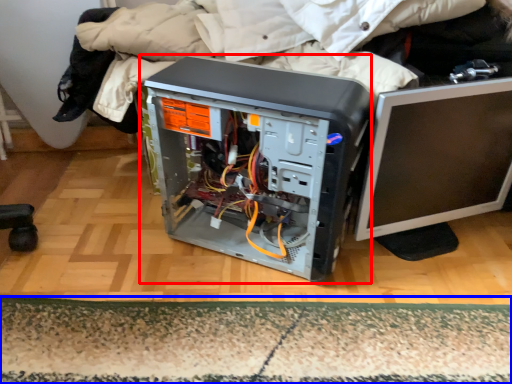
Question: Which object is closer to the camera taking this photo, computer tower (highlighted by a red box) or mat (highlighted by a blue box)?

Choices:
 (A) computer tower
 (B) mat

Answer: (A)